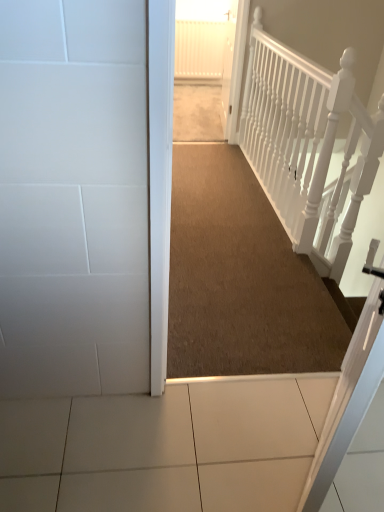
Where is `brown carpet at center`? brown carpet at center is located at coordinates (240, 277).

Describe the element at coordinates (305, 139) in the screenshot. I see `white textured rail at upper right` at that location.

You are a GUI agent. You are given a task and a screenshot of the screen. Output one action in this format:
    pyautogui.click(x=<x>, y=<y>)
    Task: Click on the carpeted hallway at center
    This screenshot has width=384, height=512.
    Given the screenshot: What is the action you would take?
    pyautogui.click(x=197, y=113)

Locate an element on the screen. brown carpet at center is located at coordinates click(x=240, y=277).

Are carpeted hallway at center and white textured rail at upper right beside each other?

No, carpeted hallway at center is not with white textured rail at upper right.

From the image's perspective, would you say carpeted hallway at center is shown under white textured rail at upper right?

Incorrect, from the image's perspective, carpeted hallway at center is higher than white textured rail at upper right.

Looking at this image, how many degrees apart are the facing directions of carpeted hallway at center and white textured rail at upper right?

They differ by 0.41 degrees in their facing directions.

Does point (219, 137) appear closer or farther from the camera than point (345, 54)?

Point (219, 137) appears to be farther away from the viewer than point (345, 54).

Is brown carpet at center positioned far away from carpeted hallway at center?

Yes.

Is brown carpet at center looking in the opposite direction of carpeted hallway at center?

Yes.

Between brown carpet at center and carpeted hallway at center, which one has larger width?

Wider between the two is brown carpet at center.

Considering the sizes of brown carpet at center and white textured rail at upper right in the image, is brown carpet at center bigger or smaller than white textured rail at upper right?

In the image, brown carpet at center appears to be smaller than white textured rail at upper right.

Is point (315, 295) farther from viewer compared to point (288, 143)?

No, (315, 295) is closer to viewer.

Is brown carpet at center facing towards white textured rail at upper right?

Yes, brown carpet at center faces towards white textured rail at upper right.

From a real-world perspective, between brown carpet at center and white textured rail at upper right, who is vertically lower?

brown carpet at center is physically lower.

Between white textured rail at upper right and carpeted hallway at center, which one is positioned in front?

Positioned in front is white textured rail at upper right.

From a real-world perspective, relative to carpeted hallway at center, is white textured rail at upper right vertically above or below?

white textured rail at upper right is situated higher than carpeted hallway at center in the real world.

Consider the image. Does white textured rail at upper right touch carpeted hallway at center?

No, white textured rail at upper right is not with carpeted hallway at center.

In terms of size, does white textured rail at upper right appear bigger or smaller than carpeted hallway at center?

In the image, white textured rail at upper right appears to be smaller than carpeted hallway at center.

Can brown carpet at center be found inside white textured rail at upper right?

No.

From the picture: Does white textured rail at upper right have a larger size compared to brown carpet at center?

Yes.

Who is taller, white textured rail at upper right or brown carpet at center?

Standing taller between the two is white textured rail at upper right.

Is carpeted hallway at center not inside brown carpet at center?

Indeed, carpeted hallway at center is completely outside brown carpet at center.

Which is more to the right, carpeted hallway at center or brown carpet at center?

brown carpet at center.

From a real-world perspective, is carpeted hallway at center below brown carpet at center?

No, from a real-world perspective, carpeted hallway at center is not under brown carpet at center.

Find the location of a particular element. The height and width of the screenshot is (512, 384). rail on the right of carpeted hallway at center is located at coordinates (305, 139).

Where is `path on the left of brown carpet at center`? Image resolution: width=384 pixels, height=512 pixels. path on the left of brown carpet at center is located at coordinates (197, 113).

Estimate the real-world distances between objects in this image. Which object is further from carpeted hallway at center, brown carpet at center or white textured rail at upper right?

Based on the image, brown carpet at center appears to be further to carpeted hallway at center.

Looking at the image, which one is located closer to brown carpet at center, carpeted hallway at center or white textured rail at upper right?

The object closer to brown carpet at center is white textured rail at upper right.

Estimate the real-world distances between objects in this image. Which object is closer to white textured rail at upper right, brown carpet at center or carpeted hallway at center?

brown carpet at center is closer to white textured rail at upper right.

Estimate the real-world distances between objects in this image. Which object is closer to white textured rail at upper right, carpeted hallway at center or brown carpet at center?

brown carpet at center is closer to white textured rail at upper right.

When comparing their distances from carpeted hallway at center, does white textured rail at upper right or brown carpet at center seem further?

Based on the image, brown carpet at center appears to be further to carpeted hallway at center.

From the image, which object appears to be farther from brown carpet at center, white textured rail at upper right or carpeted hallway at center?

Among the two, carpeted hallway at center is located further to brown carpet at center.

In order to click on corridor between white textured rail at upper right and carpeted hallway at center along the z-axis in this screenshot , I will do `click(240, 277)`.